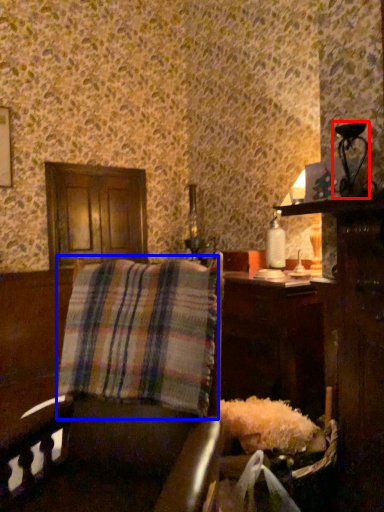
Question: Which point is closer to the camera, table lamp (highlighted by a red box) or plaid (highlighted by a blue box)?

Choices:
 (A) table lamp
 (B) plaid

Answer: (B)